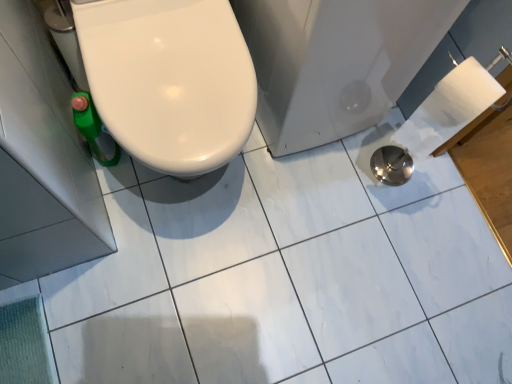
Question: Is white glossy toilet at left wider than metallic silver bath at lower right?

Choices:
 (A) no
 (B) yes

Answer: (A)

Question: Could you tell me if white glossy toilet at left is facing metallic silver bath at lower right?

Choices:
 (A) no
 (B) yes

Answer: (A)

Question: Considering the relative sizes of white glossy toilet at left and metallic silver bath at lower right in the image provided, is white glossy toilet at left taller than metallic silver bath at lower right?

Choices:
 (A) yes
 (B) no

Answer: (A)

Question: From a real-world perspective, is white glossy toilet at left physically below metallic silver bath at lower right?

Choices:
 (A) yes
 (B) no

Answer: (B)

Question: Can you confirm if white glossy toilet at left is smaller than metallic silver bath at lower right?

Choices:
 (A) yes
 (B) no

Answer: (A)

Question: From a real-world perspective, is white glossy toilet at left positioned over metallic silver bath at lower right based on gravity?

Choices:
 (A) yes
 (B) no

Answer: (A)

Question: Can you confirm if metallic silver bath at lower right is taller than white glossy toilet at left?

Choices:
 (A) no
 (B) yes

Answer: (A)

Question: From a real-world perspective, is metallic silver bath at lower right on white glossy toilet at left?

Choices:
 (A) yes
 (B) no

Answer: (B)

Question: Is metallic silver bath at lower right smaller than white glossy toilet at left?

Choices:
 (A) yes
 (B) no

Answer: (B)

Question: Is metallic silver bath at lower right to the right of white glossy toilet at left from the viewer's perspective?

Choices:
 (A) no
 (B) yes

Answer: (B)

Question: Is metallic silver bath at lower right closer to camera compared to white glossy toilet at left?

Choices:
 (A) yes
 (B) no

Answer: (B)

Question: Would you consider metallic silver bath at lower right to be distant from white glossy toilet at left?

Choices:
 (A) yes
 (B) no

Answer: (B)

Question: Is metallic silver bath at lower right in front of or behind white glossy toilet at left in the image?

Choices:
 (A) front
 (B) behind

Answer: (B)